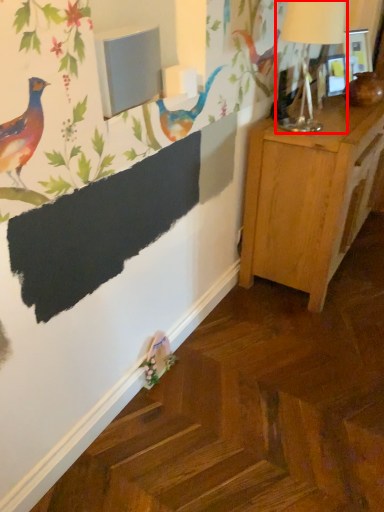
Question: From the image, what is the correct spatial relationship of table lamp (annotated by the red box) in relation to nightstand?

Choices:
 (A) right
 (B) left

Answer: (B)